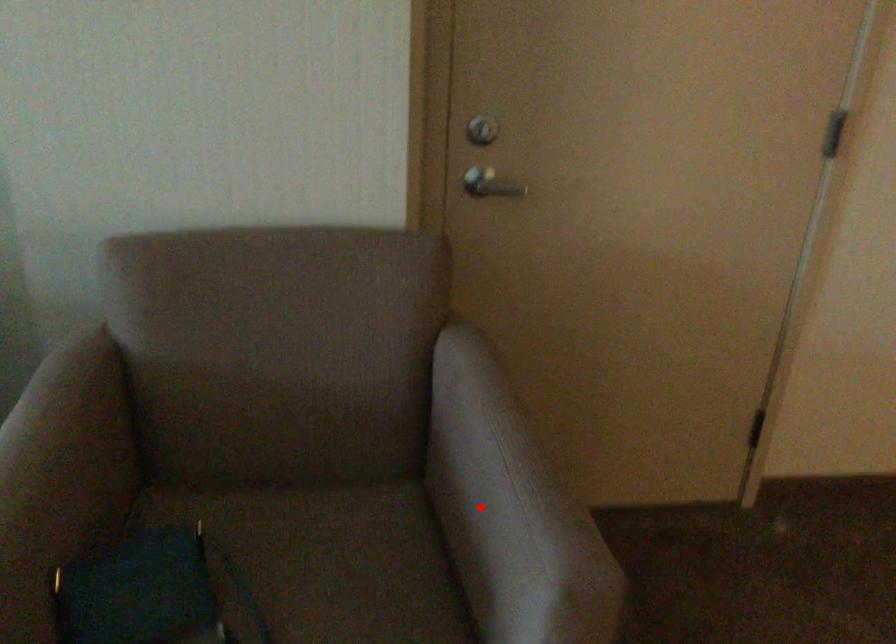
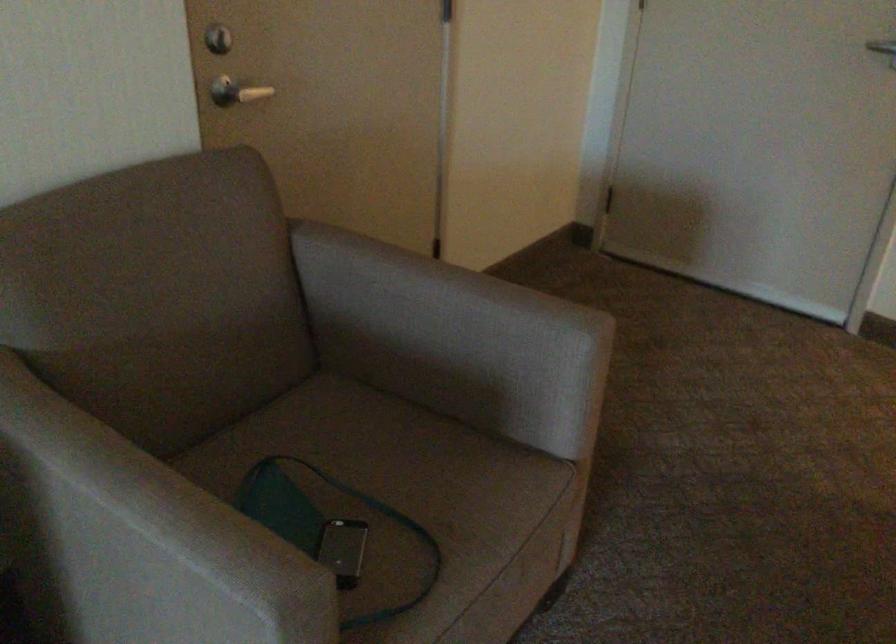
The point at the highlighted location is marked in the first image. Where is the corresponding point in the second image?

(453, 339)